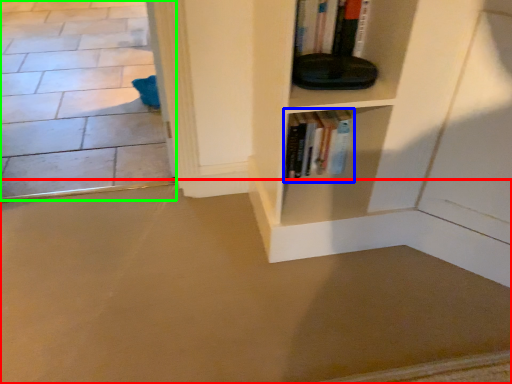
Question: Estimate the real-world distances between objects in this image. Which object is closer to concrete (highlighted by a red box), book (highlighted by a blue box) or concrete (highlighted by a green box)?

Choices:
 (A) book
 (B) concrete

Answer: (A)